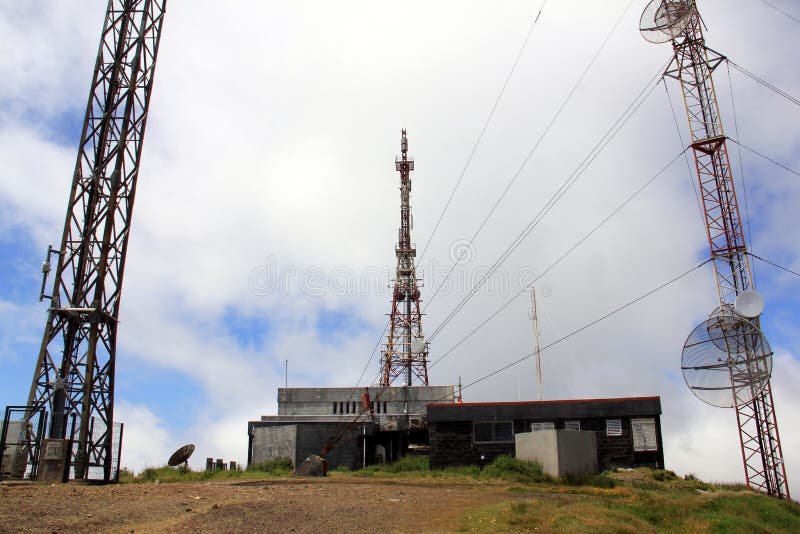
Locate an element on the screen. Image resolution: width=800 pixels, height=534 pixels. dish is located at coordinates (730, 347), (742, 311), (674, 21).